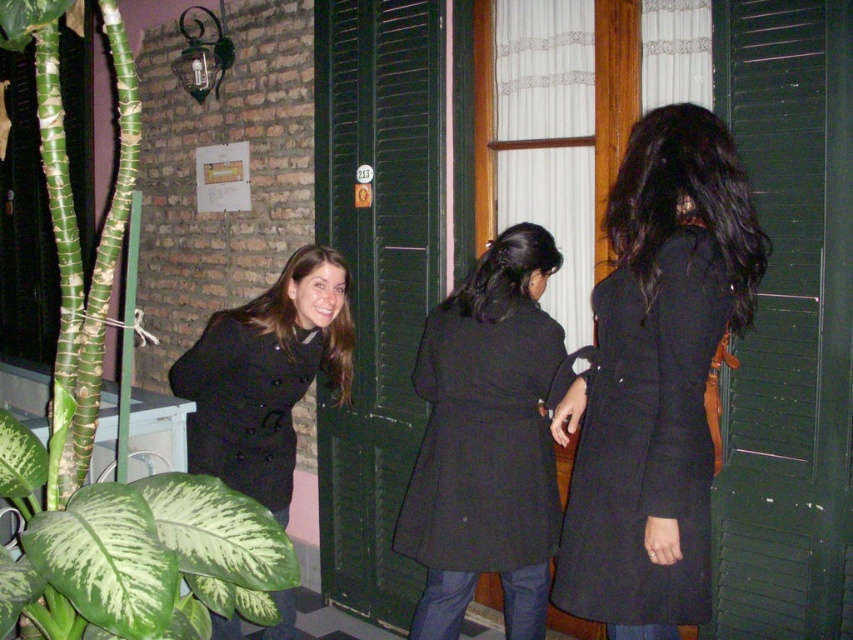
Question: From the image, what is the correct spatial relationship of green leafy plant at left in relation to matte black coat at center?

Choices:
 (A) right
 (B) left

Answer: (B)

Question: Considering the relative positions of black wool coat at right and green variegated leaf at lower left in the image provided, where is black wool coat at right located with respect to green variegated leaf at lower left?

Choices:
 (A) below
 (B) above

Answer: (B)

Question: Which object is farther from the camera taking this photo?

Choices:
 (A) matte black coat at left
 (B) black wool coat at center
 (C) black wool coat at right

Answer: (A)

Question: Which of the following is the farthest from the observer?

Choices:
 (A) black matte coat at center
 (B) green variegated leaf at lower left
 (C) black wool coat at center
 (D) black wool coat at right

Answer: (C)

Question: Considering the real-world distances, which object is farthest from the black wool coat at right?

Choices:
 (A) black wool coat at center
 (B) smooth black coat at center
 (C) matte black coat at center

Answer: (C)

Question: In this image, where is green leafy plant at left located relative to smooth black coat at center?

Choices:
 (A) right
 (B) left

Answer: (B)